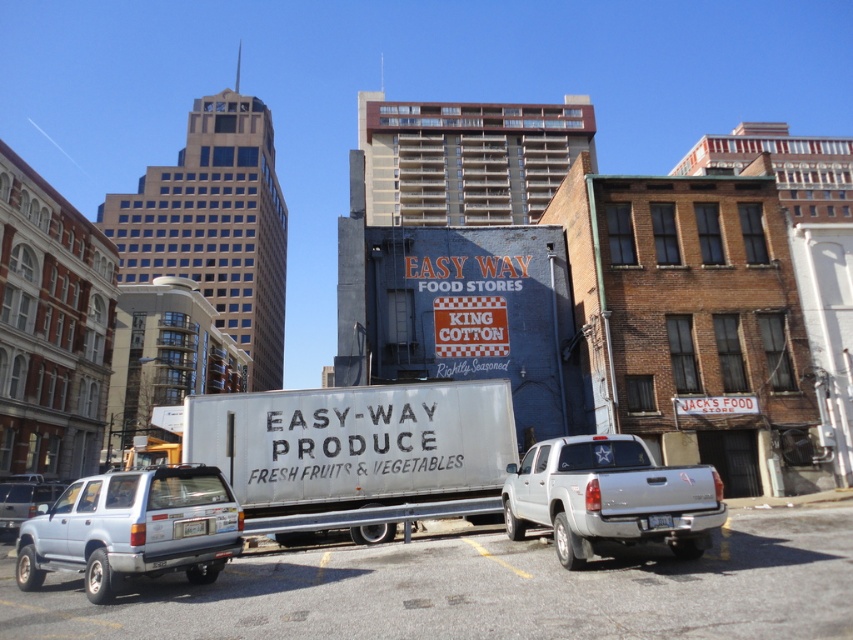
Question: Does white metallic trailer truck at center appear on the right side of white plastic license plate at lower left?

Choices:
 (A) yes
 (B) no

Answer: (A)

Question: Which object is closer to the camera taking this photo?

Choices:
 (A) white metallic trailer truck at center
 (B) white plastic license plate at center
 (C) satin silver suv at lower left

Answer: (C)

Question: Which of the following is the closest to the observer?

Choices:
 (A) (x=650, y=516)
 (B) (x=619, y=541)
 (C) (x=49, y=486)

Answer: (A)

Question: Does silver metallic suv at lower left appear over white plastic license plate at center?

Choices:
 (A) yes
 (B) no

Answer: (B)

Question: Is white metallic trailer truck at center positioned behind white plastic license plate at lower left?

Choices:
 (A) yes
 (B) no

Answer: (A)

Question: Based on their relative distances, which object is nearer to the white plastic license plate at center?

Choices:
 (A) satin silver suv at lower left
 (B) white plastic license plate at lower left

Answer: (B)